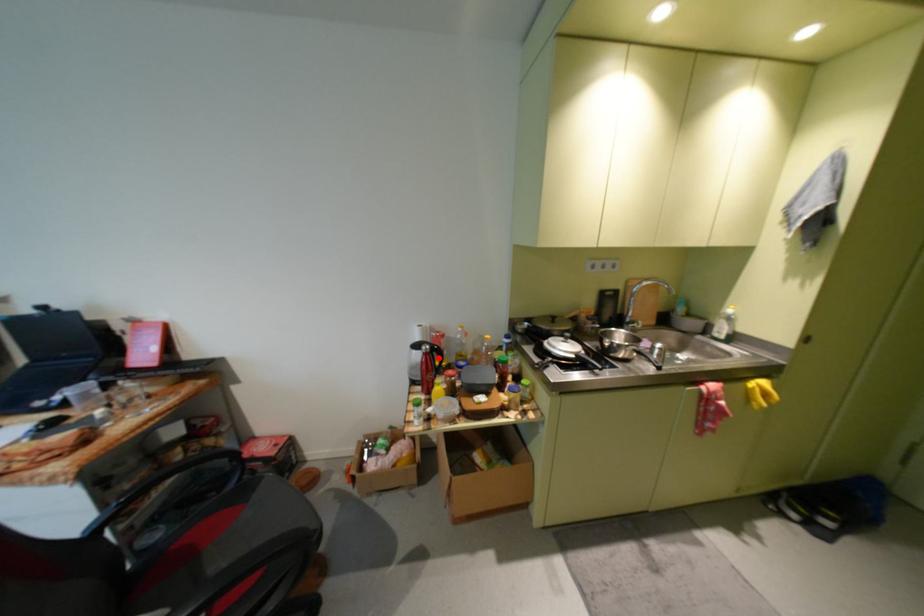
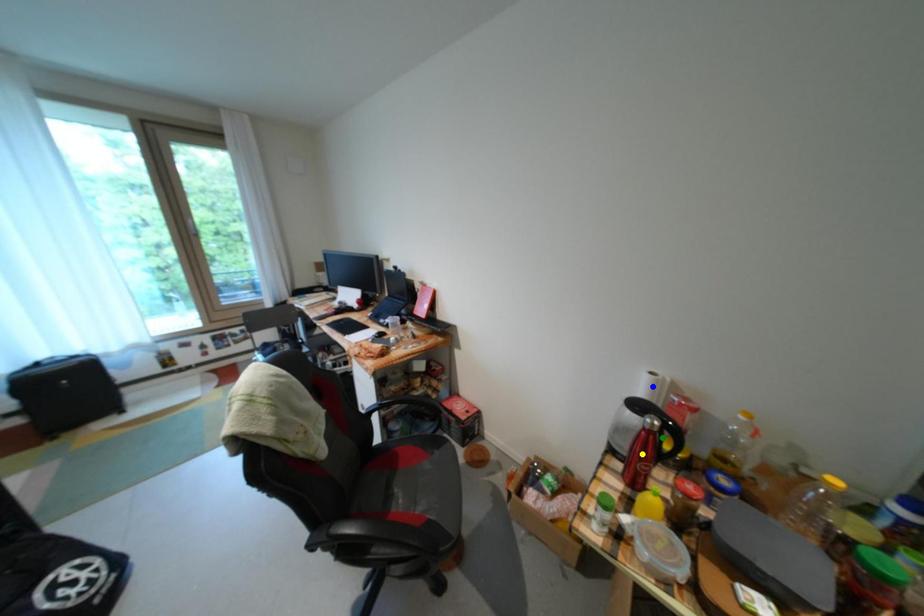
Question: I am providing you with two images of the same scene from different viewpoints. A red point is marked on the first image. You are given multiple points on the second image. Which point in image 2 is actually the same real-world point as the red point in image 1?

Choices:
 (A) green point
 (B) yellow point
 (C) blue point

Answer: (A)